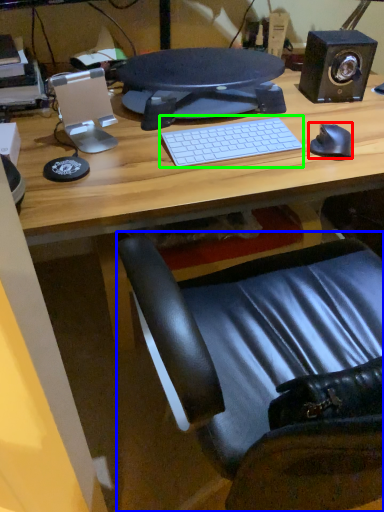
Question: Which object is the farthest from mouse (highlighted by a red box)? Choose among these: chair (highlighted by a blue box) or computer keyboard (highlighted by a green box).

Choices:
 (A) chair
 (B) computer keyboard

Answer: (A)